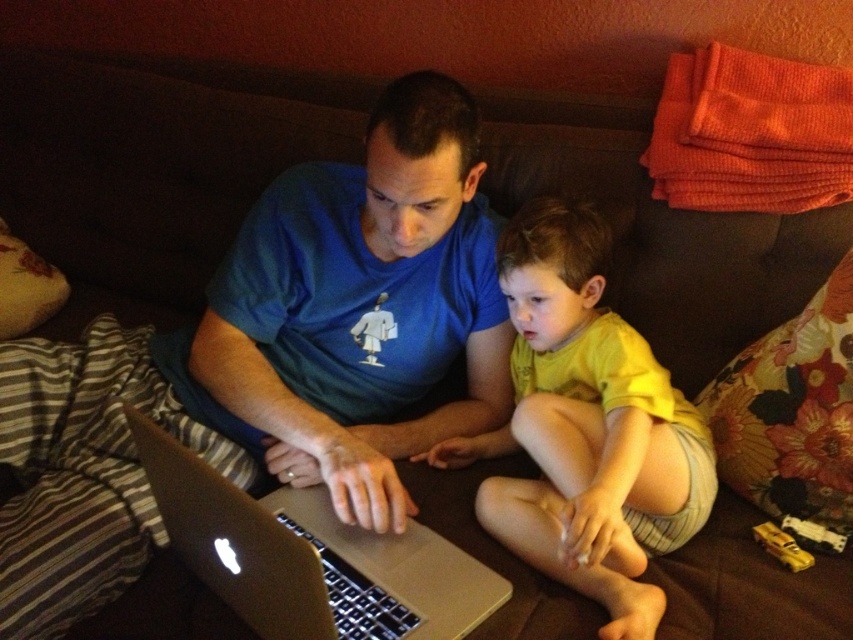
You are a photographer taking a portrait of the two people sitting on the couch. You want to ensure that both the yellow cotton shirt at center and the silver metallic laptop at center are clearly visible in the photo. Which object should you focus on to make sure both are in focus?

The yellow cotton shirt at center is taller than the silver metallic laptop at center, so focusing on the yellow cotton shirt at center will ensure both are in focus since it is the taller object.

You are standing in front of the couch where the adult and child are sitting. You want to hand the child a toy located in your pocket. The toy is 12 inches long. Considering the distance between you and the yellow cotton shirt at center, can you safely reach the child without disturbing the adult or the laptop?

The distance between you and the yellow cotton shirt at center is 35.58 inches. Since the toy is only 12 inches long, you cannot safely reach the child without moving closer. You should approach to within 12 inches or less to hand the toy without disturbing them.